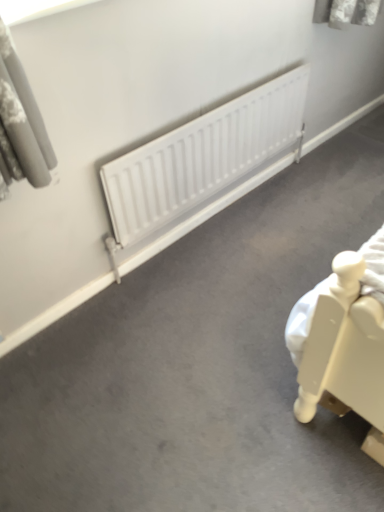
Question: Should I look upward or downward to see white matte radiator at center?

Choices:
 (A) down
 (B) up

Answer: (B)